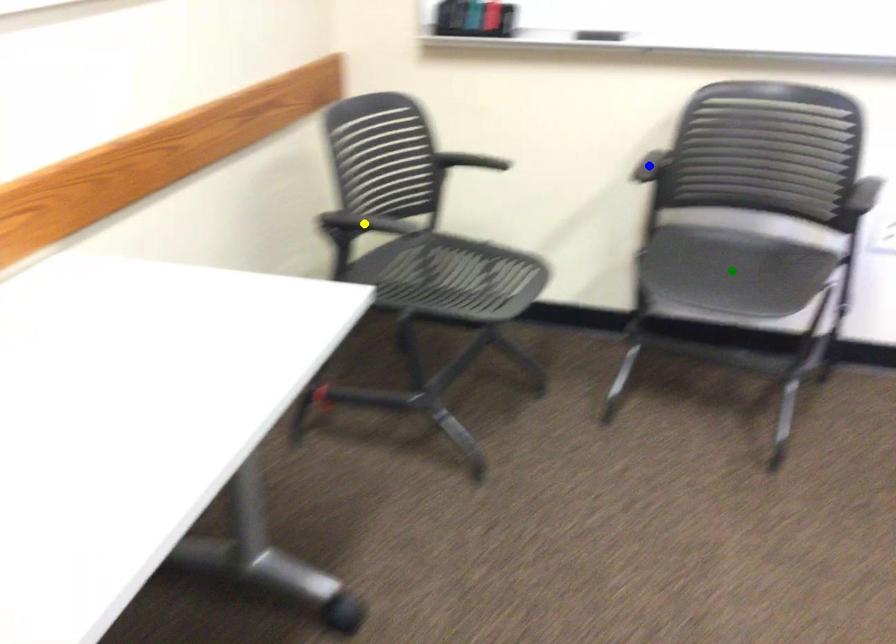
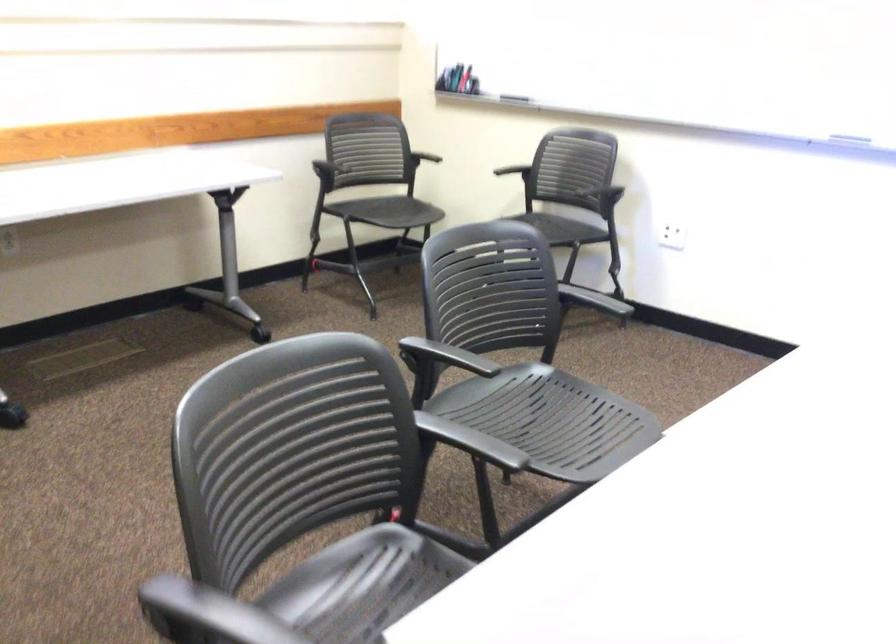
I am providing you with two images of the same scene from different viewpoints. Three points are marked in image1. Which point corresponds to a part or object that is occluded in image2?In image1, three points are marked. Which of them correspond to a part or object that is occluded in image2?Among the three points shown in image1, which one corresponds to a part or object that is no longer visible due to occlusion in image2?

Invisible in image2: green point.